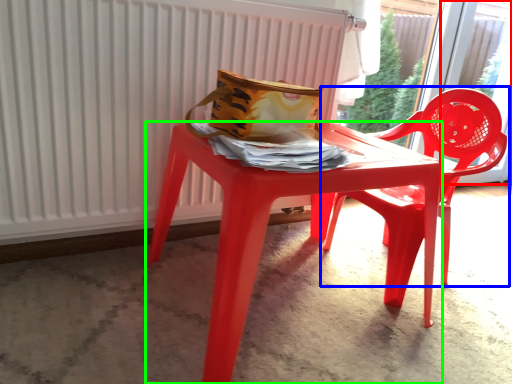
Question: Based on their relative distances, which object is nearer to window (highlighted by a red box)? Choose from chair (highlighted by a blue box) and table (highlighted by a green box).

Choices:
 (A) chair
 (B) table

Answer: (A)